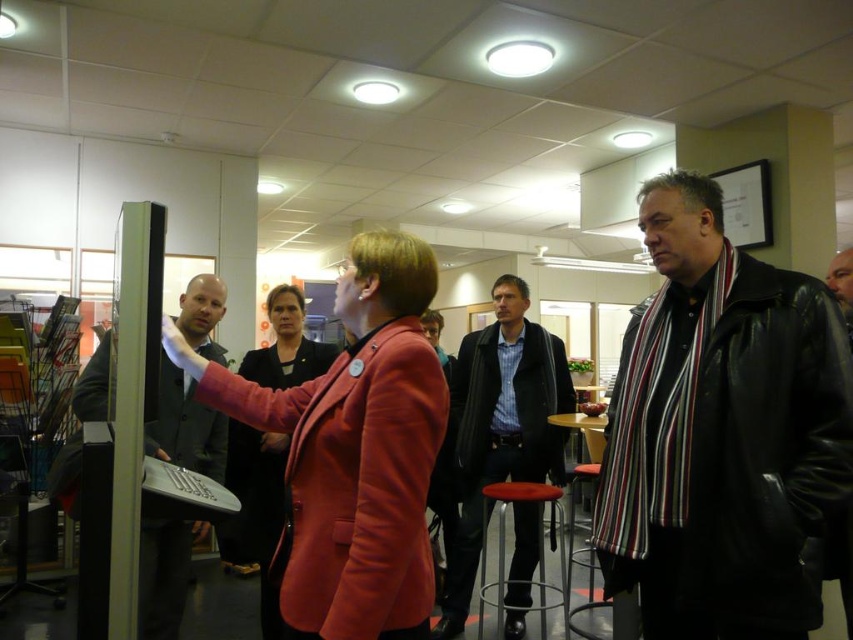
Question: Can you confirm if black leather jacket at right is smaller than matte red blazer at center?

Choices:
 (A) yes
 (B) no

Answer: (B)

Question: Is matte pink blazer at center to the right of metallic silver bar stool at center from the viewer's perspective?

Choices:
 (A) no
 (B) yes

Answer: (A)

Question: Which point appears farthest from the camera in this image?

Choices:
 (A) (244, 538)
 (B) (544, 627)

Answer: (B)

Question: Can you confirm if black leather jacket at right is smaller than matte pink blazer at center?

Choices:
 (A) no
 (B) yes

Answer: (A)

Question: Which point is closer to the camera taking this photo?

Choices:
 (A) (820, 612)
 (B) (561, 508)
 (C) (405, 458)

Answer: (C)

Question: Which point is farther to the camera?

Choices:
 (A) metallic silver bar stool at center
 (B) dark gray suit at left
 (C) matte pink blazer at center
 (D) black leather jacket at right

Answer: (A)